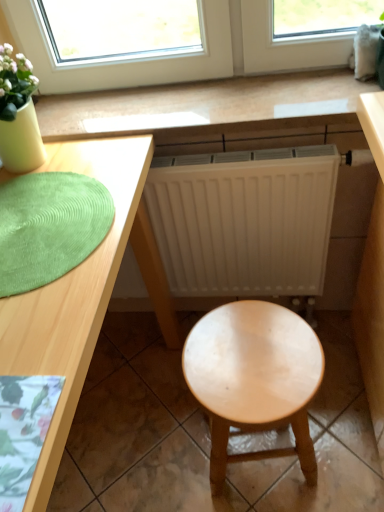
Question: Considering the relative sizes of light wood desk at center and light brown wood stool at center in the image provided, is light wood desk at center wider than light brown wood stool at center?

Choices:
 (A) no
 (B) yes

Answer: (B)

Question: Is light wood desk at center thinner than light brown wood stool at center?

Choices:
 (A) yes
 (B) no

Answer: (B)

Question: Considering the relative sizes of light wood desk at center and light brown wood stool at center in the image provided, is light wood desk at center shorter than light brown wood stool at center?

Choices:
 (A) no
 (B) yes

Answer: (A)

Question: Does light wood desk at center appear on the right side of light brown wood stool at center?

Choices:
 (A) no
 (B) yes

Answer: (A)

Question: Is light wood desk at center positioned beyond the bounds of light brown wood stool at center?

Choices:
 (A) no
 (B) yes

Answer: (B)

Question: Is light wood desk at center not close to light brown wood stool at center?

Choices:
 (A) yes
 (B) no

Answer: (B)

Question: Considering the relative sizes of light wood desk at center and green textured mat at left in the image provided, is light wood desk at center thinner than green textured mat at left?

Choices:
 (A) yes
 (B) no

Answer: (B)

Question: Is light wood desk at center oriented away from green textured mat at left?

Choices:
 (A) no
 (B) yes

Answer: (A)

Question: Considering the relative positions of light wood desk at center and green textured mat at left in the image provided, is light wood desk at center to the left of green textured mat at left from the viewer's perspective?

Choices:
 (A) yes
 (B) no

Answer: (A)

Question: Considering the relative positions of light wood desk at center and green textured mat at left in the image provided, is light wood desk at center in front of green textured mat at left?

Choices:
 (A) yes
 (B) no

Answer: (A)

Question: Can you confirm if light wood desk at center is bigger than green textured mat at left?

Choices:
 (A) yes
 (B) no

Answer: (A)

Question: Does light wood desk at center have a greater height compared to green textured mat at left?

Choices:
 (A) yes
 (B) no

Answer: (A)

Question: From the image's perspective, would you say green textured mat at left is shown under light wood desk at center?

Choices:
 (A) no
 (B) yes

Answer: (A)